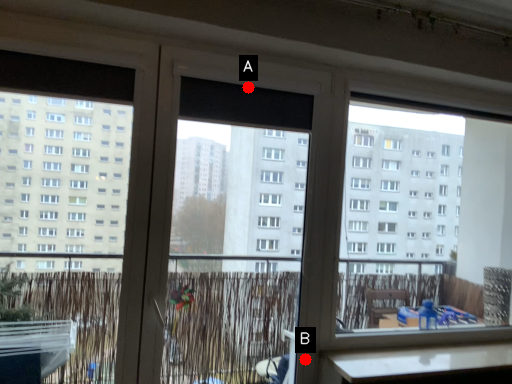
Question: Two points are circled on the image, labeled by A and B beside each circle. Which point appears closest to the camera in this image?

Choices:
 (A) A is closer
 (B) B is closer

Answer: (A)